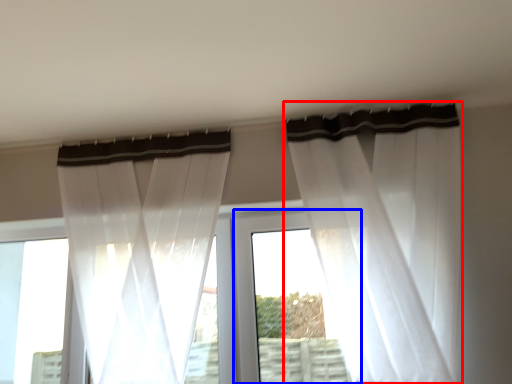
Question: Among these objects, which one is farthest to the camera, curtain (highlighted by a red box) or window frame (highlighted by a blue box)?

Choices:
 (A) curtain
 (B) window frame

Answer: (B)